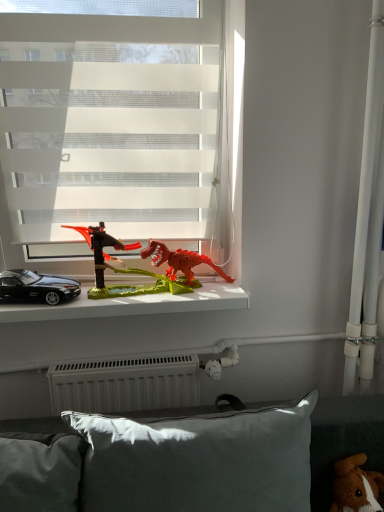
At what (x,y) coordinates should I click in order to perform the action: click on vacant area on top of black plastic car at left (from a real-world perspective). Please return your answer as a coordinate pair (x, y). The height and width of the screenshot is (512, 384). Looking at the image, I should click on (109, 290).